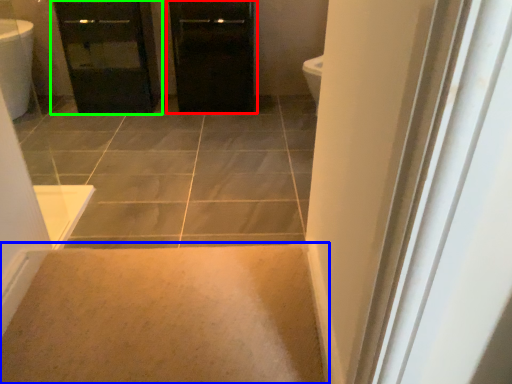
Question: Based on their relative distances, which object is nearer to door (highlighted by a red box)? Choose from plain (highlighted by a blue box) and bathroom cabinet (highlighted by a green box).

Choices:
 (A) plain
 (B) bathroom cabinet

Answer: (B)